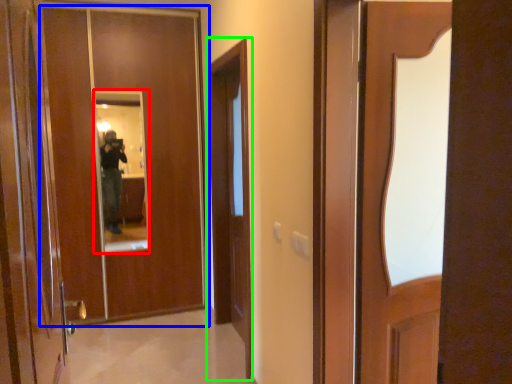
Question: Based on their relative distances, which object is farther from mirror (highlighted by a red box)? Choose from door (highlighted by a blue box) and screen door (highlighted by a green box).

Choices:
 (A) door
 (B) screen door

Answer: (B)